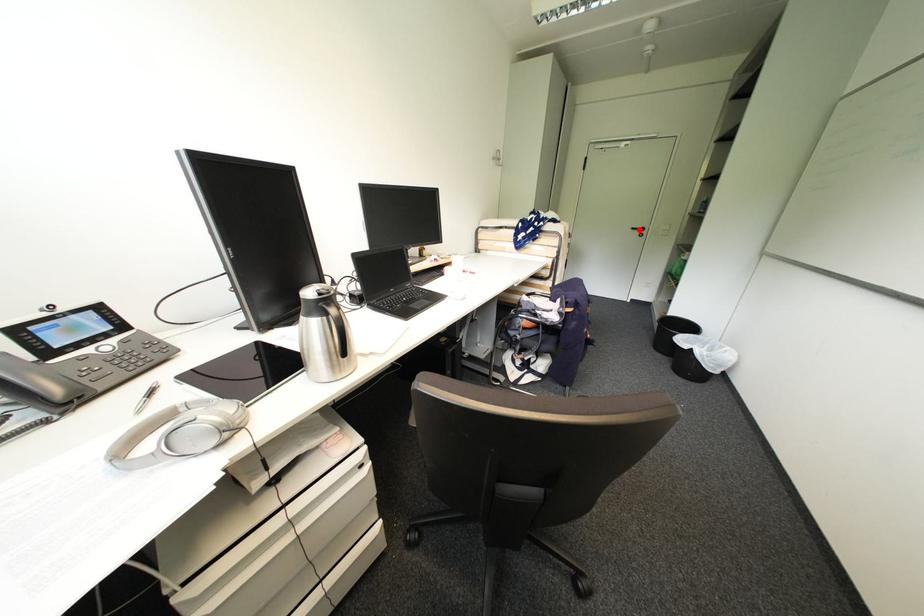
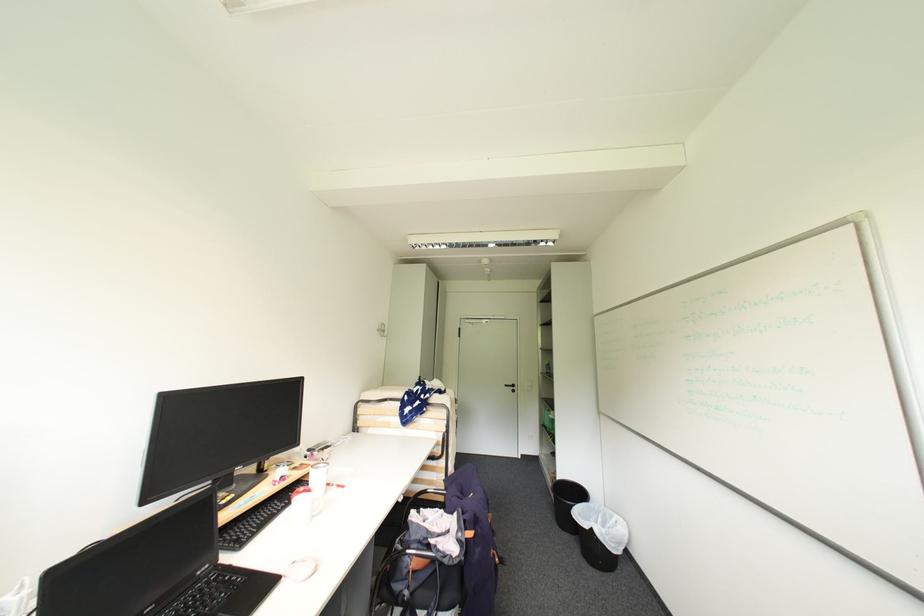
Locate, in the second image, the point that corresponds to the highlighted location in the first image.

(513, 387)